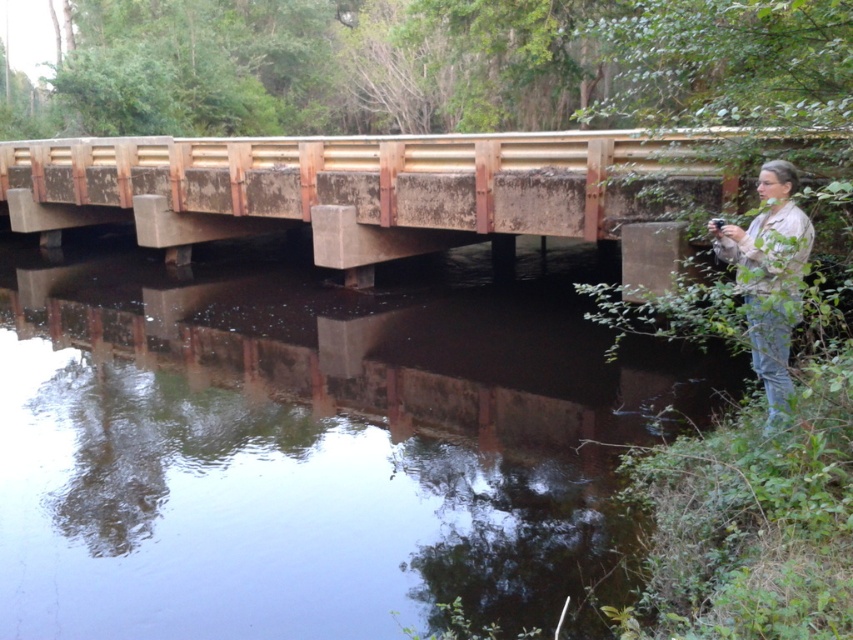
Question: Does rusty concrete bridge at center appear over tan fabric jacket at right?

Choices:
 (A) no
 (B) yes

Answer: (B)

Question: Estimate the real-world distances between objects in this image. Which object is closer to the rusty concrete bridge at center?

Choices:
 (A) tan fabric jacket at right
 (B) brown concrete river at lower center

Answer: (B)

Question: Which point is farther from the camera taking this photo?

Choices:
 (A) (167, 205)
 (B) (788, 288)
 (C) (80, 570)

Answer: (A)

Question: Does rusty concrete bridge at center come in front of tan fabric jacket at right?

Choices:
 (A) no
 (B) yes

Answer: (A)

Question: Which of the following is the farthest from the observer?

Choices:
 (A) brown concrete river at lower center
 (B) rusty concrete bridge at center
 (C) tan fabric jacket at right

Answer: (B)

Question: Is brown concrete river at lower center to the left of rusty concrete bridge at center from the viewer's perspective?

Choices:
 (A) yes
 (B) no

Answer: (B)